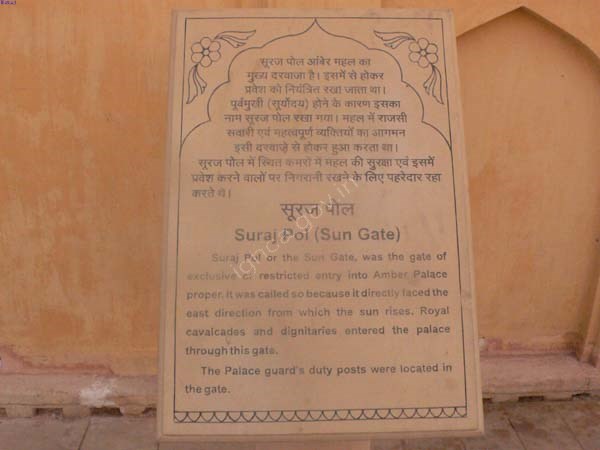
The width and height of the screenshot is (600, 450). Find the location of `terra cotta wall background`. terra cotta wall background is located at coordinates [x=40, y=308], [x=141, y=226], [x=37, y=162], [x=131, y=69], [x=40, y=26], [x=511, y=35], [x=582, y=146], [x=496, y=173], [x=519, y=280], [x=584, y=13].